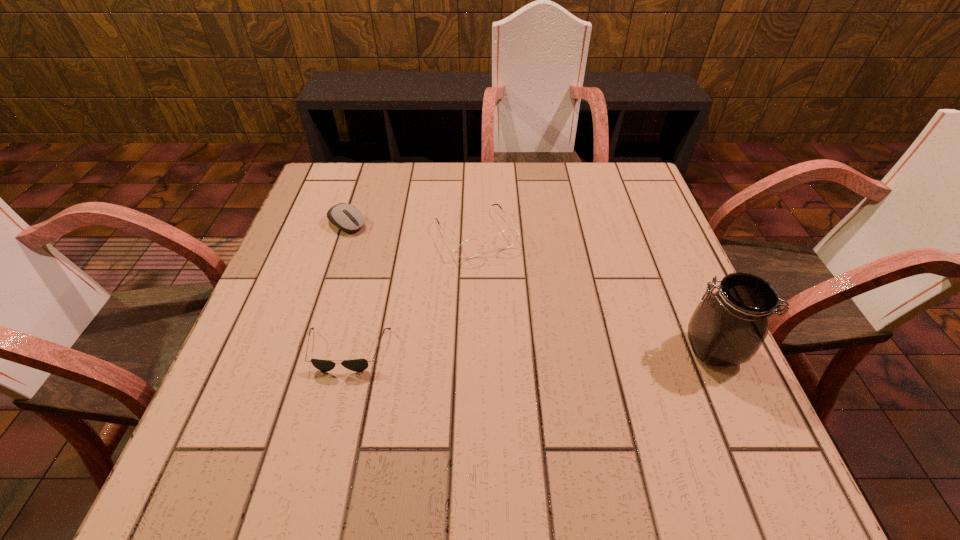
You are a GUI agent. You are given a task and a screenshot of the screen. Output one action in this format:
    pyautogui.click(x=<x>, y=<y>)
    Task: Click on the sunglasses
    Image resolution: width=960 pixels, height=540 pixels.
    Given the screenshot: What is the action you would take?
    pyautogui.click(x=357, y=365)

Image resolution: width=960 pixels, height=540 pixels. I want to click on jar, so click(x=728, y=327).

You are a GUI agent. You are given a task and a screenshot of the screen. Output one action in this format:
    pyautogui.click(x=<x>, y=<y>)
    Task: Click on the tallest object
    The image size is (960, 540).
    Given the screenshot: What is the action you would take?
    pyautogui.click(x=728, y=327)

Where is `the third object from left to right`? the third object from left to right is located at coordinates (468, 249).

Locate an element on the screen. spectacles is located at coordinates (468, 249).

I want to click on computer equipment, so click(348, 218).

The height and width of the screenshot is (540, 960). I want to click on free spot located 0.070m on the lenses of the sunglasses, so click(x=333, y=408).

Identify the location of vacant space located 0.400m on the lid of the rightmost object. (476, 349).

This screenshot has width=960, height=540. What are the coordinates of `free space located on the lid of the rightmost object` in the screenshot? It's located at (564, 349).

You are a GUI agent. You are given a task and a screenshot of the screen. Output one action in this format:
    pyautogui.click(x=<x>, y=<y>)
    Task: Click on the vacant position located 0.190m on the lid of the rightmost object
    The height and width of the screenshot is (540, 960).
    Given the screenshot: What is the action you would take?
    pyautogui.click(x=585, y=349)